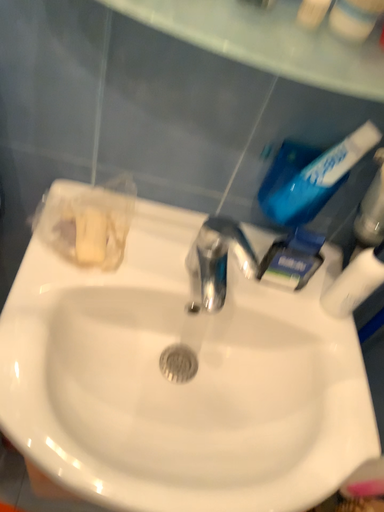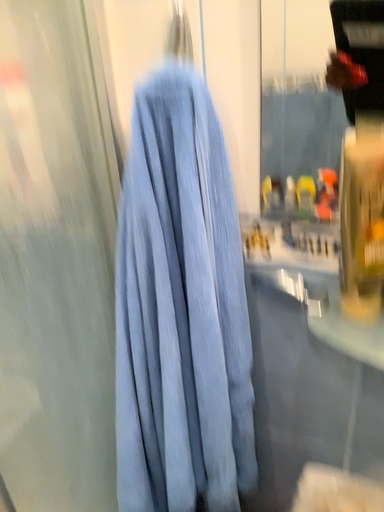
Question: Which way did the camera rotate in the video?

Choices:
 (A) rotated downward
 (B) rotated upward

Answer: (B)